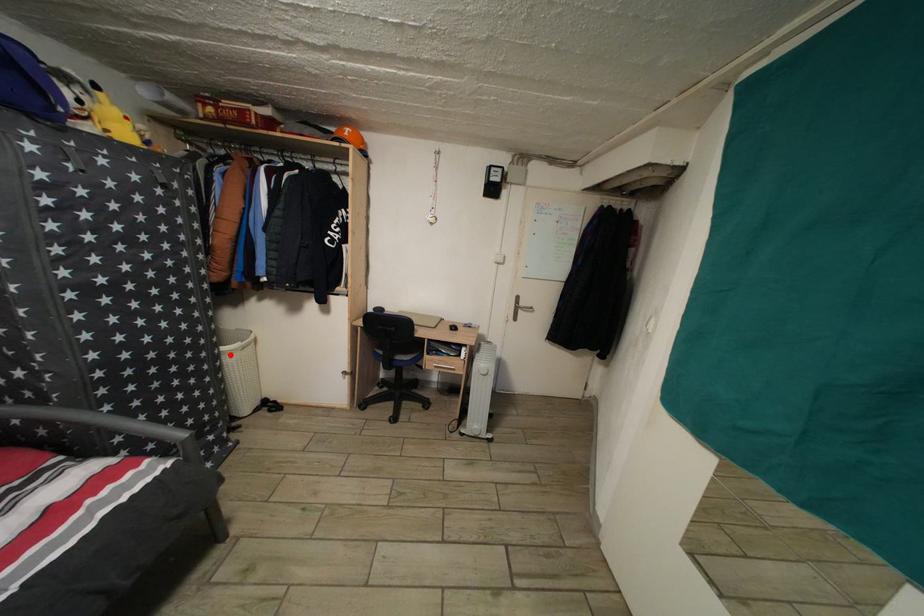
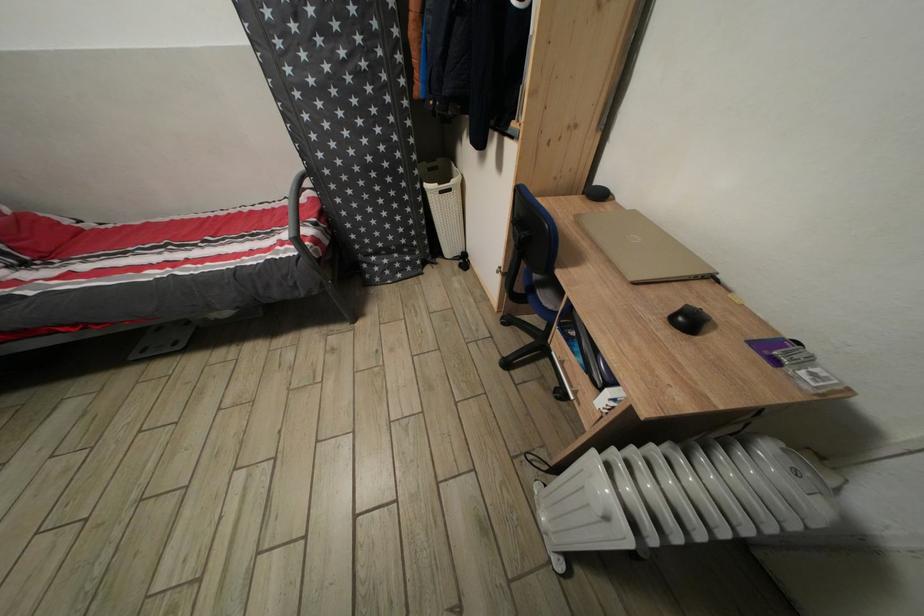
Question: I am providing you with two images of the same scene from different viewpoints. Given a red point in image1, look at the same physical point in image2. Is it:

Choices:
 (A) Closer to the viewpoint
 (B) Farther from the viewpoint

Answer: (A)